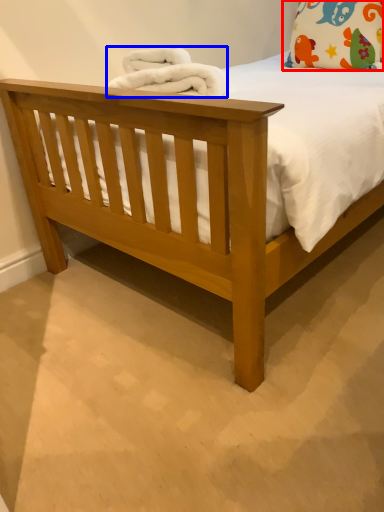
Question: Which object is closer to the camera taking this photo, pillow (highlighted by a red box) or material (highlighted by a blue box)?

Choices:
 (A) pillow
 (B) material

Answer: (B)